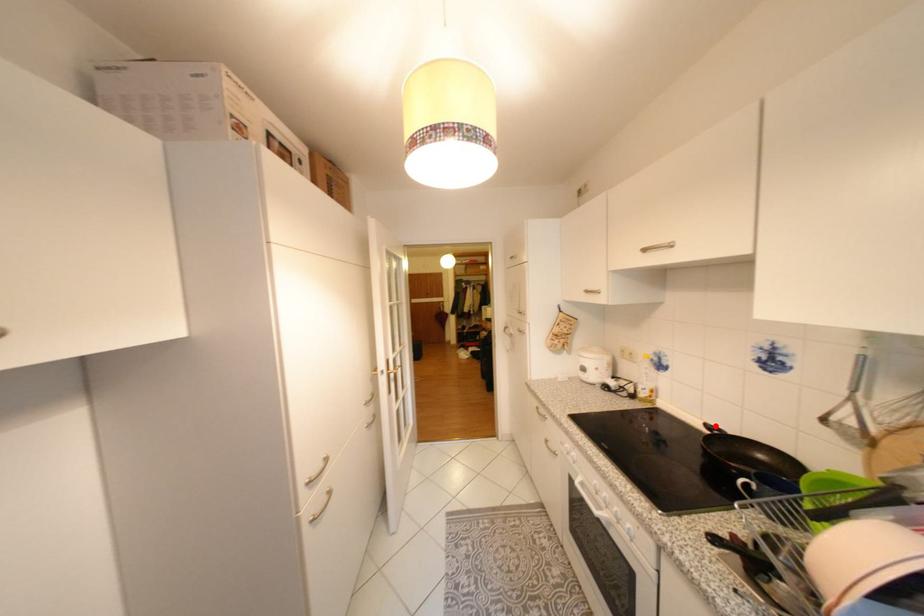
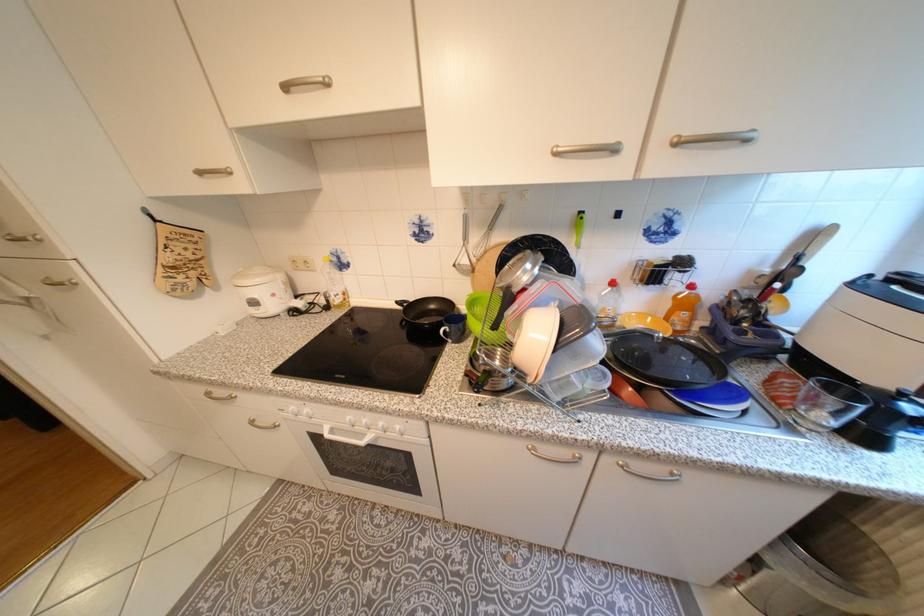
In the second image, find the point that corresponds to the highlighted location in the first image.

(407, 302)